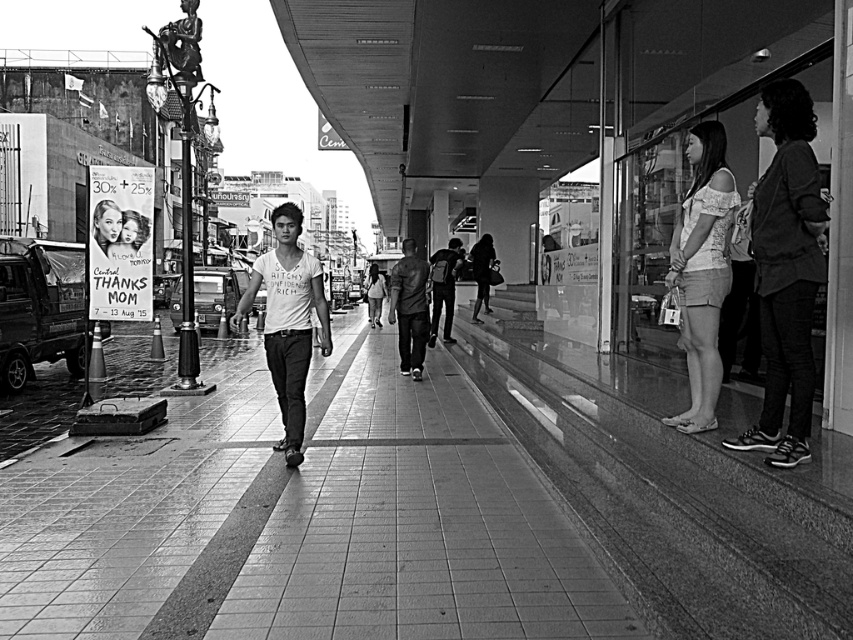
Is white lace top at right smaller than white cotton shirt at center?

Indeed, white lace top at right has a smaller size compared to white cotton shirt at center.

Who is more distant from viewer, [669,289] or [286,208]?

Positioned behind is point [286,208].

You are a GUI agent. You are given a task and a screenshot of the screen. Output one action in this format:
    pyautogui.click(x=<x>, y=<y>)
    Task: Click on the white lace top at right
    
    Given the screenshot: What is the action you would take?
    pyautogui.click(x=701, y=269)

Identify the location of white lace top at right. The height and width of the screenshot is (640, 853). (701, 269).

Is dark gray sweater at right bigger than leather jacket at center?

No.

Image resolution: width=853 pixels, height=640 pixels. What are the coordinates of `dark gray sweater at right` in the screenshot? It's located at (785, 272).

Which of these two, dark gray sweater at right or white cotton shirt at center, stands shorter?

Standing shorter between the two is dark gray sweater at right.

Is point (784, 352) positioned behind point (265, 301)?

No, it is in front of (265, 301).

Does point (807, 211) come farther from viewer compared to point (310, 324)?

No, it is not.

Identify the location of dark gray sweater at right. (785, 272).